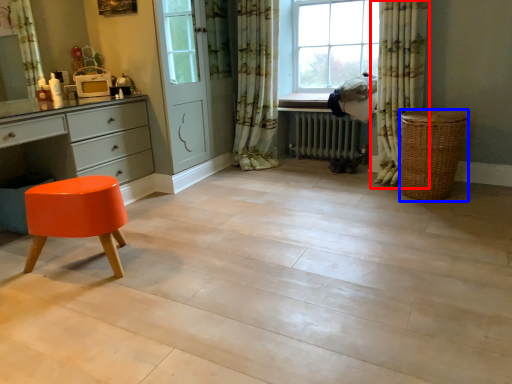
Question: Which of the following is the farthest to the observer, curtain (highlighted by a red box) or basket (highlighted by a blue box)?

Choices:
 (A) curtain
 (B) basket

Answer: (A)